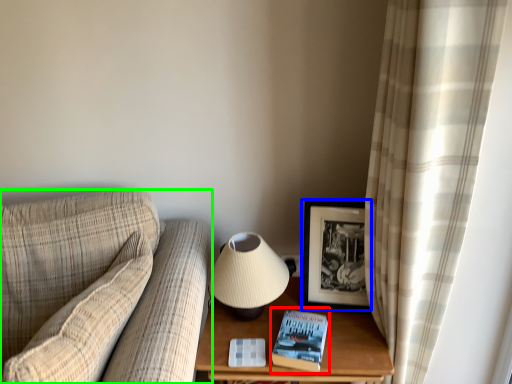
Question: Estimate the real-world distances between objects in this image. Which object is farther from paperback book (highlighted by a red box), picture frame (highlighted by a blue box) or studio couch (highlighted by a green box)?

Choices:
 (A) picture frame
 (B) studio couch

Answer: (B)